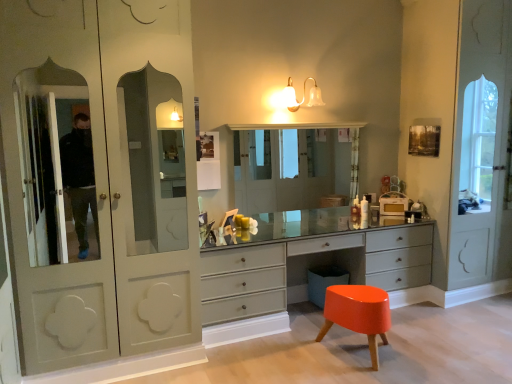
Locate an element on the screen. vacant area located to the right-hand side of orange glossy stool at lower right is located at coordinates (432, 364).